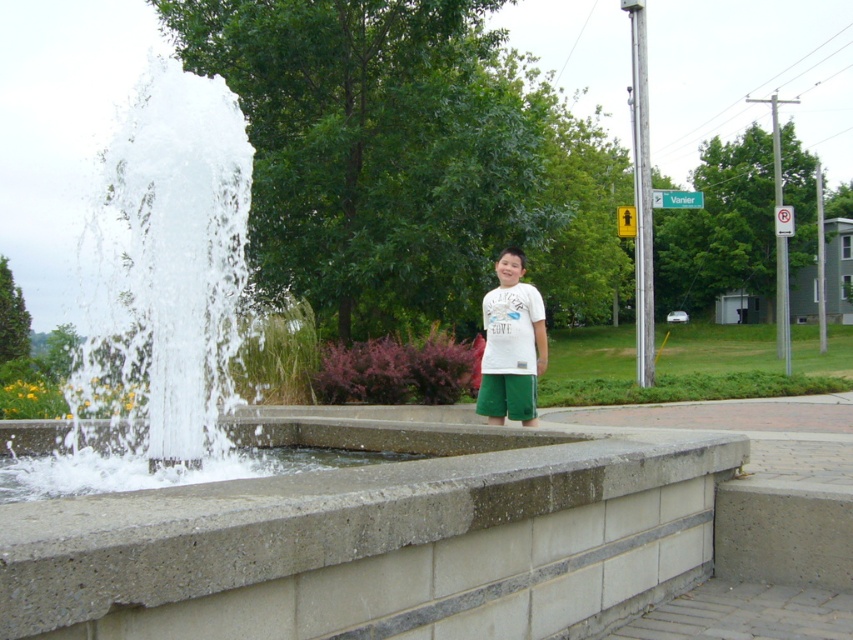
Can you confirm if concrete ledge at center is positioned to the left of white cotton shirt at center?

Correct, you'll find concrete ledge at center to the left of white cotton shirt at center.

Can you confirm if concrete ledge at center is smaller than white cotton shirt at center?

No.

Locate an element on the screen. The width and height of the screenshot is (853, 640). concrete ledge at center is located at coordinates (376, 538).

You are a GUI agent. You are given a task and a screenshot of the screen. Output one action in this format:
    pyautogui.click(x=<x>, y=<y>)
    Task: Click on the concrete ledge at center
    The width and height of the screenshot is (853, 640).
    Given the screenshot: What is the action you would take?
    pyautogui.click(x=376, y=538)